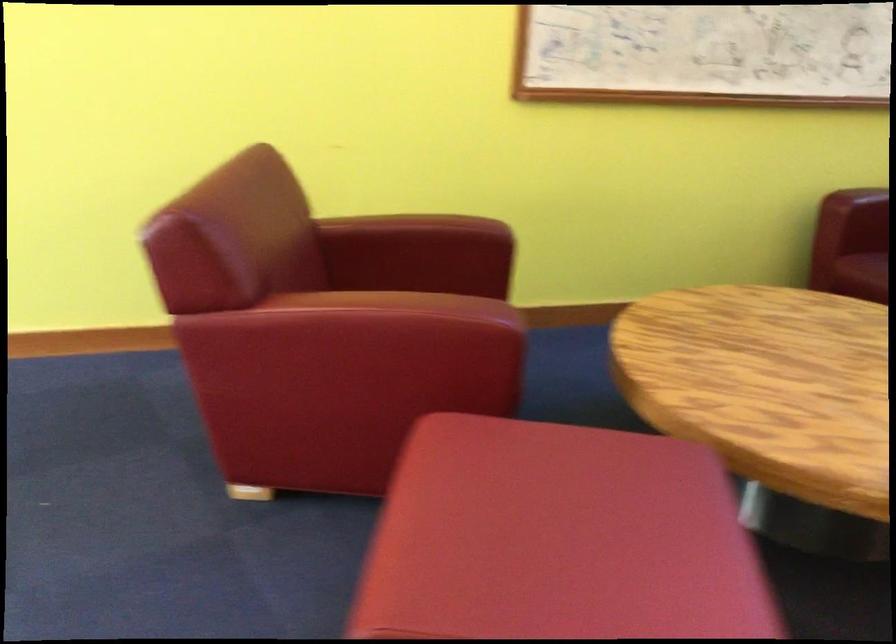
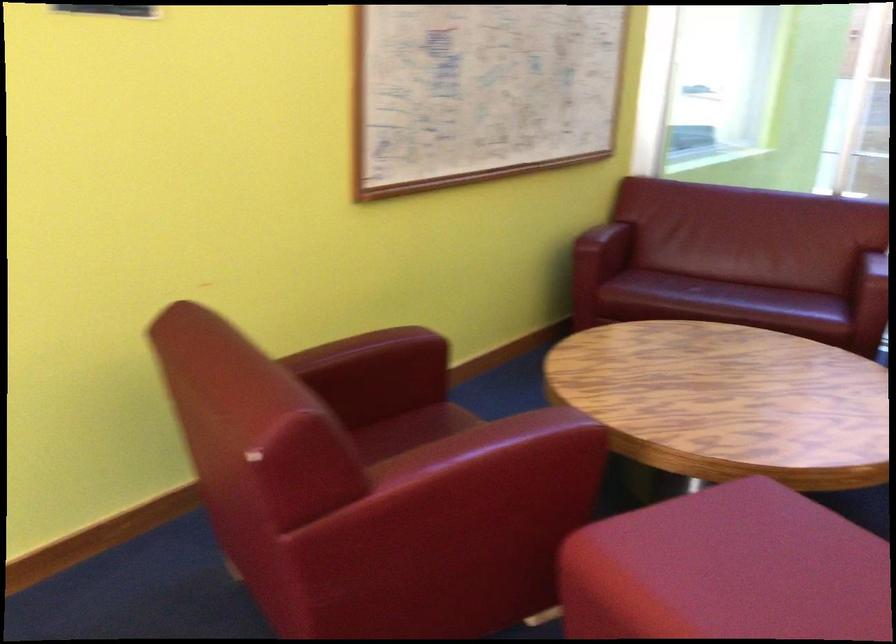
Find the pixel in the second image that matches point (521, 484) in the first image.

(727, 570)